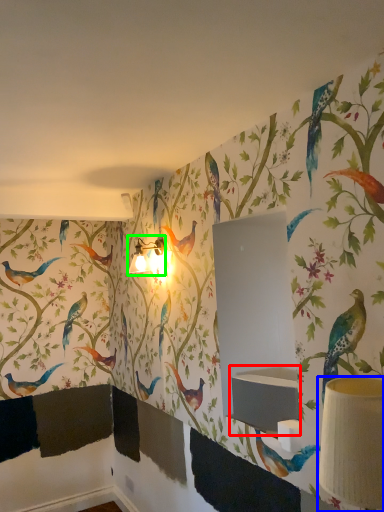
Question: Which is nearer to the sink (highlighted by a red box)? table lamp (highlighted by a blue box) or table lamp (highlighted by a green box).

Choices:
 (A) table lamp
 (B) table lamp

Answer: (A)